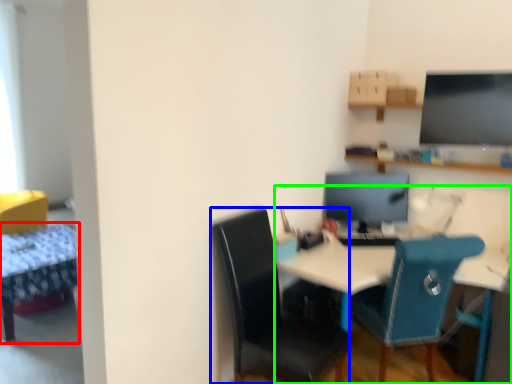
Question: Considering the real-world distances, which object is closest to table (highlighted by a red box)? chair (highlighted by a blue box) or desk (highlighted by a green box).

Choices:
 (A) chair
 (B) desk

Answer: (A)